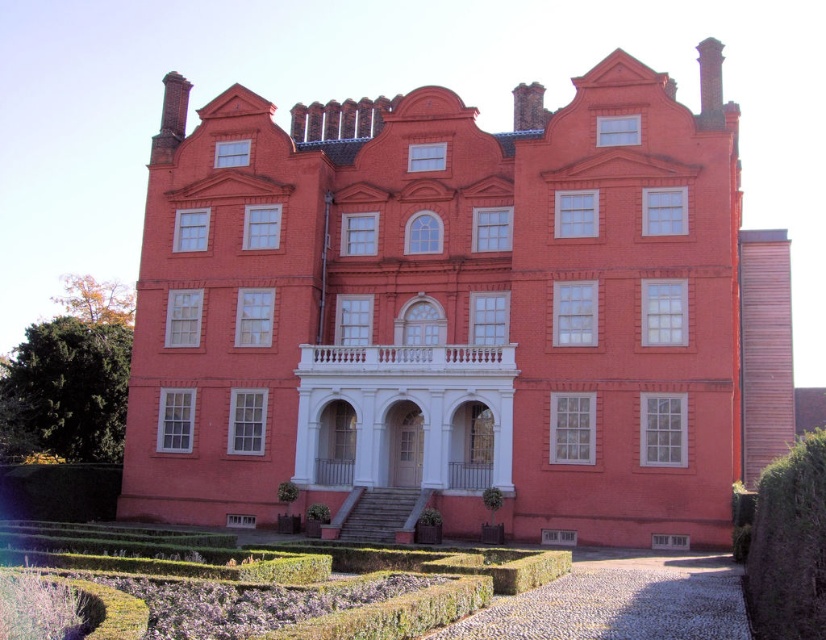
Question: Which point is closer to the camera?

Choices:
 (A) (544, 579)
 (B) (805, 580)

Answer: (B)

Question: Can you confirm if matte brick mansion at center is wider than green leafy hedge at lower left?

Choices:
 (A) yes
 (B) no

Answer: (A)

Question: Among these points, which one is farthest from the camera?

Choices:
 (A) (749, 624)
 (B) (585, 362)

Answer: (B)

Question: Does matte brick mansion at center appear on the right side of dark green textured hedge at lower right?

Choices:
 (A) yes
 (B) no

Answer: (B)

Question: Can you confirm if matte brick mansion at center is positioned above green leafy hedge at lower left?

Choices:
 (A) yes
 (B) no

Answer: (A)

Question: Which point appears farthest from the camera in this image?

Choices:
 (A) (221, 570)
 (B) (259, 444)
 (C) (65, 330)
 (D) (787, 518)

Answer: (C)